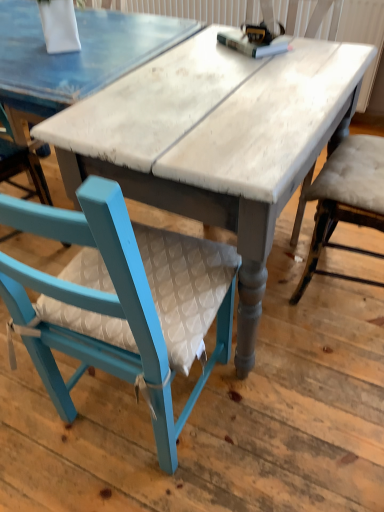
The image size is (384, 512). What do you see at coordinates (215, 140) in the screenshot? I see `white painted wood table at center` at bounding box center [215, 140].

Based on the photo, what is the approximate width of white painted wood table at center?

39.05 inches.

Find the location of a particular element. This screenshot has height=512, width=384. white painted wood table at center is located at coordinates (215, 140).

What do you see at coordinates (102, 307) in the screenshot?
I see `teal painted wood chair at lower left` at bounding box center [102, 307].

Measure the distance between point (44,379) and camera.

Point (44,379) and camera are 1.13 meters apart from each other.

In order to face teal painted wood chair at lower left, should I rotate leftwards or rightwards?

Rotate left and turn 8.449 degrees.

Identify the location of teal painted wood chair at lower left. (102, 307).

Locate an element on the screen. This screenshot has height=512, width=384. white painted wood table at center is located at coordinates (215, 140).

Is teal painted wood chair at lower left to the left of white painted wood table at center from the viewer's perspective?

Indeed, teal painted wood chair at lower left is positioned on the left side of white painted wood table at center.

Is teal painted wood chair at lower left closer to camera compared to white painted wood table at center?

Yes, teal painted wood chair at lower left is closer to the camera.

Which is nearer, (123, 273) or (330, 50)?

Point (123, 273) is positioned closer to the camera compared to point (330, 50).

From the image's perspective, is teal painted wood chair at lower left above or below white painted wood table at center?

teal painted wood chair at lower left is below white painted wood table at center.

From a real-world perspective, between teal painted wood chair at lower left and white painted wood table at center, who is vertically higher?

teal painted wood chair at lower left, from a real-world perspective.

Which of these two, teal painted wood chair at lower left or white painted wood table at center, is thinner?

Thinner between the two is teal painted wood chair at lower left.

Considering the relative sizes of teal painted wood chair at lower left and white painted wood table at center in the image provided, is teal painted wood chair at lower left shorter than white painted wood table at center?

In fact, teal painted wood chair at lower left may be taller than white painted wood table at center.

Who is smaller, teal painted wood chair at lower left or white painted wood table at center?

With smaller size is teal painted wood chair at lower left.

Is teal painted wood chair at lower left not within white painted wood table at center?

Yes, teal painted wood chair at lower left is located beyond the bounds of white painted wood table at center.

Is the surface of teal painted wood chair at lower left in direct contact with white painted wood table at center?

No, teal painted wood chair at lower left is not touching white painted wood table at center.

Looking at this image, is teal painted wood chair at lower left looking in the opposite direction of white painted wood table at center?

No, teal painted wood chair at lower left is not facing the opposite direction of white painted wood table at center.

What's the angular difference between teal painted wood chair at lower left and white painted wood table at center's facing directions?

The facing directions of teal painted wood chair at lower left and white painted wood table at center are 178 degrees apart.

How much distance is there between teal painted wood chair at lower left and white painted wood table at center?

teal painted wood chair at lower left and white painted wood table at center are 17.55 inches apart.

Image resolution: width=384 pixels, height=512 pixels. I want to click on chair below the white painted wood table at center (from the image's perspective), so click(102, 307).

Visually, is white painted wood table at center positioned to the left or to the right of teal painted wood chair at lower left?

white painted wood table at center is to the right of teal painted wood chair at lower left.

Is white painted wood table at center positioned in front of teal painted wood chair at lower left?

No, white painted wood table at center is further to the viewer.

Which is in front, point (258, 194) or point (84, 242)?

The point (84, 242) is closer.

From the image's perspective, which is below, white painted wood table at center or teal painted wood chair at lower left?

From the image's view, teal painted wood chair at lower left is below.

From a real-world perspective, is white painted wood table at center beneath teal painted wood chair at lower left?

Correct, in the physical world, white painted wood table at center is lower than teal painted wood chair at lower left.

Between white painted wood table at center and teal painted wood chair at lower left, which one has larger width?

white painted wood table at center is wider.

Which of these two, white painted wood table at center or teal painted wood chair at lower left, stands shorter?

Standing shorter between the two is white painted wood table at center.

Between white painted wood table at center and teal painted wood chair at lower left, which one has smaller size?

teal painted wood chair at lower left.

Could teal painted wood chair at lower left be considered to be inside white painted wood table at center?

No, teal painted wood chair at lower left is not inside white painted wood table at center.

Is white painted wood table at center far from teal painted wood chair at lower left?

white painted wood table at center is actually quite close to teal painted wood chair at lower left.

Is white painted wood table at center oriented towards teal painted wood chair at lower left?

Yes, white painted wood table at center is oriented towards teal painted wood chair at lower left.

Image resolution: width=384 pixels, height=512 pixels. I want to click on chair above the white painted wood table at center (from a real-world perspective), so click(102, 307).

Where is `table above the teal painted wood chair at lower left (from the image's perspective)`? table above the teal painted wood chair at lower left (from the image's perspective) is located at coordinates (215, 140).

Where is `chair located above the white painted wood table at center (from a real-world perspective)`? chair located above the white painted wood table at center (from a real-world perspective) is located at coordinates (102, 307).